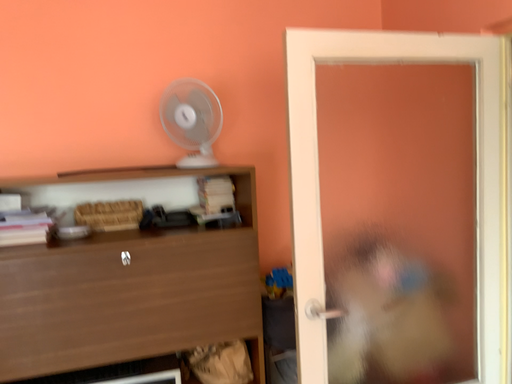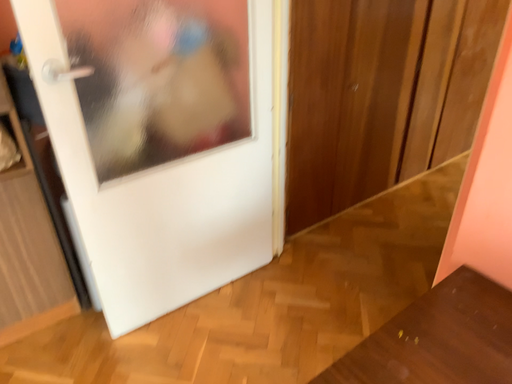
Question: How did the camera likely rotate when shooting the video?

Choices:
 (A) rotated right
 (B) rotated left

Answer: (A)